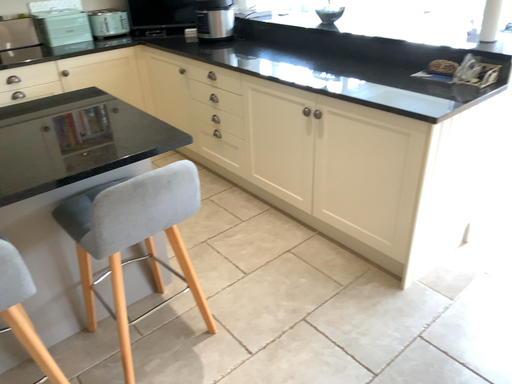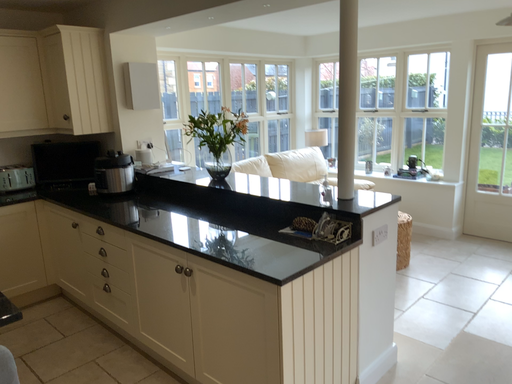
Question: How did the camera likely rotate when shooting the video?

Choices:
 (A) rotated downward
 (B) rotated upward

Answer: (B)